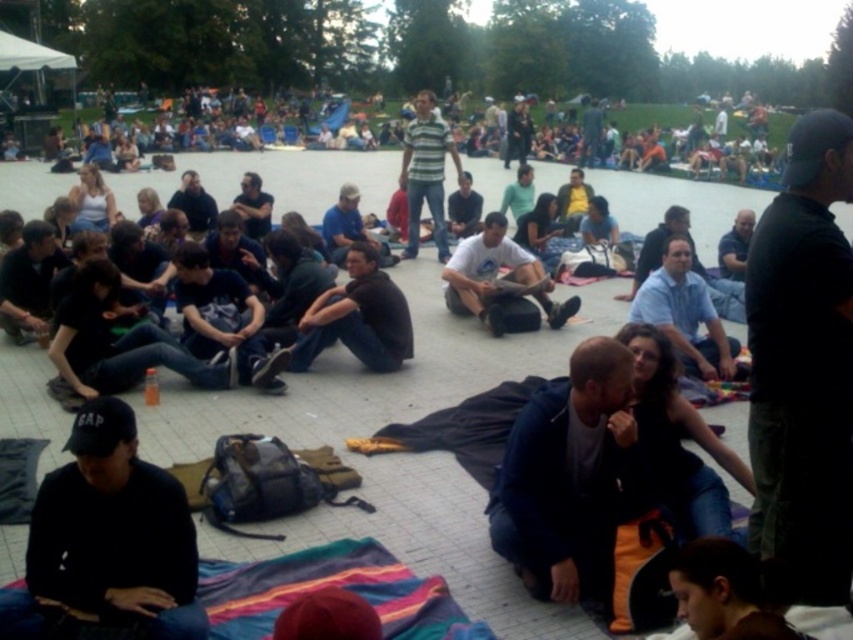
Question: Which point is farther from the camera taking this photo?

Choices:
 (A) (396, 320)
 (B) (115, 532)

Answer: (A)

Question: Can you confirm if dark blue jacket at lower center is positioned to the right of black matte shirt at center?

Choices:
 (A) yes
 (B) no

Answer: (A)

Question: Which object is the closest to the black matte cap at lower left?

Choices:
 (A) black matte shirt at center
 (B) dark blue jacket at lower center
 (C) white cotton t-shirt at center

Answer: (B)

Question: Which point appears closest to the camera in this image?

Choices:
 (A) (503, 323)
 (B) (583, 371)

Answer: (B)

Question: Does black matte cap at lower left lie in front of dark blue jacket at lower center?

Choices:
 (A) no
 (B) yes

Answer: (B)

Question: Observing the image, what is the correct spatial positioning of black matte shirt at center in reference to white cotton t-shirt at center?

Choices:
 (A) left
 (B) right

Answer: (A)